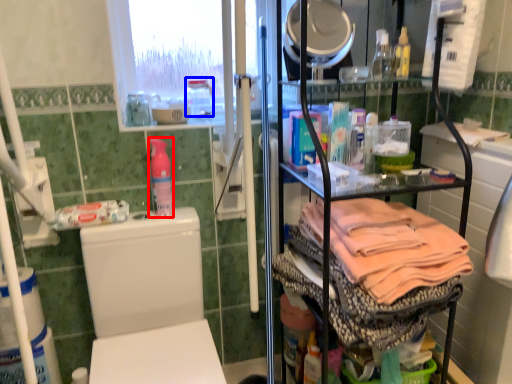
Question: Which object appears farthest to the camera in this image, bottle (highlighted by a red box) or bottle (highlighted by a blue box)?

Choices:
 (A) bottle
 (B) bottle

Answer: (B)